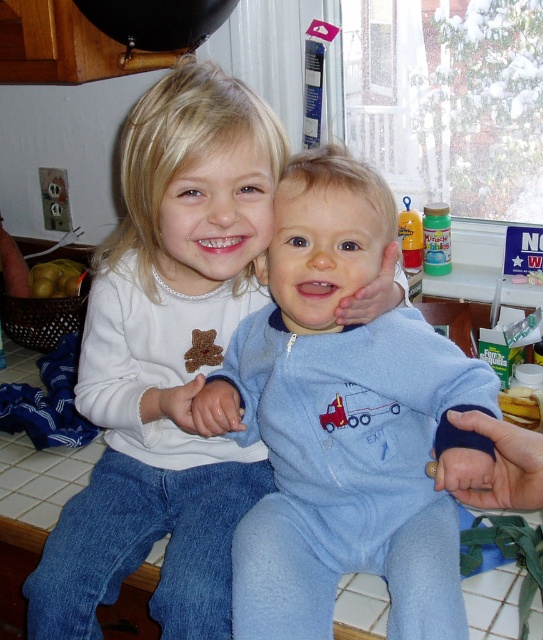
Question: Can you confirm if matte white shirt at center is positioned to the right of blue fleece onesie at center?

Choices:
 (A) yes
 (B) no

Answer: (B)

Question: Does matte white shirt at center have a greater width compared to blue fleece onesie at center?

Choices:
 (A) yes
 (B) no

Answer: (A)

Question: Which point is closer to the camera?

Choices:
 (A) matte white shirt at center
 (B) blue fleece onesie at center

Answer: (B)

Question: Is matte white shirt at center further to camera compared to blue fleece onesie at center?

Choices:
 (A) yes
 (B) no

Answer: (A)